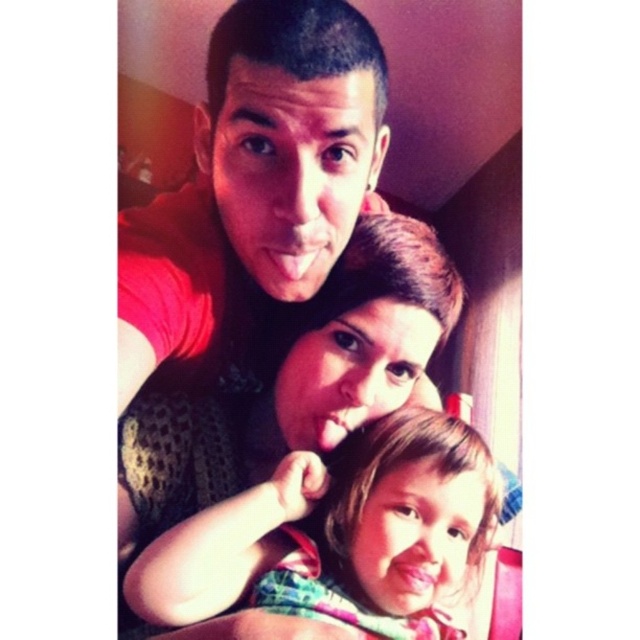
Consider the image. Does red matte t-shirt at upper left have a lesser height compared to multicolored fabric dress at center?

In fact, red matte t-shirt at upper left may be taller than multicolored fabric dress at center.

Can you confirm if red matte t-shirt at upper left is thinner than multicolored fabric dress at center?

Yes, red matte t-shirt at upper left is thinner than multicolored fabric dress at center.

Identify the location of red matte t-shirt at upper left. This screenshot has width=640, height=640. (257, 177).

Where is `red matte t-shirt at upper left`? The height and width of the screenshot is (640, 640). red matte t-shirt at upper left is located at coordinates (257, 177).

Looking at this image, does red matte t-shirt at upper left have a greater width compared to matte black shirt at center?

No.

What do you see at coordinates (257, 177) in the screenshot? I see `red matte t-shirt at upper left` at bounding box center [257, 177].

Measure the distance between point (x=323, y=198) and camera.

Point (x=323, y=198) is 21.34 inches from camera.

In order to click on red matte t-shirt at upper left in this screenshot , I will do `click(257, 177)`.

Does multicolored fabric dress at center have a smaller size compared to matte black shirt at center?

Correct, multicolored fabric dress at center occupies less space than matte black shirt at center.

Can you confirm if multicolored fabric dress at center is positioned below matte black shirt at center?

Yes, multicolored fabric dress at center is below matte black shirt at center.

What do you see at coordinates (340, 536) in the screenshot? I see `multicolored fabric dress at center` at bounding box center [340, 536].

Find the location of a particular element. This screenshot has height=640, width=640. multicolored fabric dress at center is located at coordinates (340, 536).